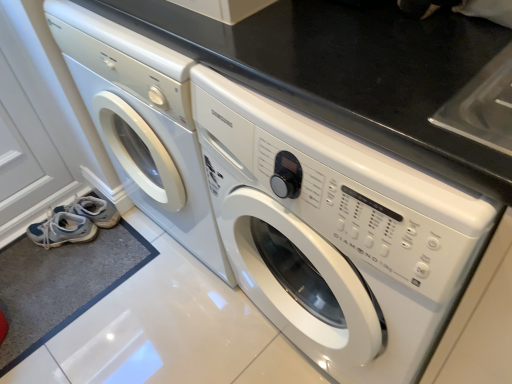
Question: From a real-world perspective, is light blue fabric shoe at lower left, which is the first shoe from bottom to top, located higher than white fabric shoe at lower left, which is the 2th shoe in bottom-to-top order?

Choices:
 (A) no
 (B) yes

Answer: (B)

Question: Considering the relative sizes of light blue fabric shoe at lower left, which is the first shoe from bottom to top, and white fabric shoe at lower left, the 1th shoe from the top, in the image provided, is light blue fabric shoe at lower left, which is the first shoe from bottom to top, shorter than white fabric shoe at lower left, the 1th shoe from the top,?

Choices:
 (A) no
 (B) yes

Answer: (B)

Question: Does light blue fabric shoe at lower left, the 2th shoe viewed from the top, contain white fabric shoe at lower left, the 1th shoe from the top?

Choices:
 (A) yes
 (B) no

Answer: (B)

Question: Is light blue fabric shoe at lower left, which is the first shoe from bottom to top, outside of white fabric shoe at lower left, which is the 2th shoe in bottom-to-top order?

Choices:
 (A) no
 (B) yes

Answer: (B)

Question: Does light blue fabric shoe at lower left, which is the first shoe from bottom to top, appear on the left side of white fabric shoe at lower left, which is the 2th shoe in bottom-to-top order?

Choices:
 (A) yes
 (B) no

Answer: (A)

Question: Considering the positions of white glossy washing machine at center, the second washing machine viewed from the right, and white glossy washing machine at center, the 1th washing machine positioned from the right, in the image, is white glossy washing machine at center, the second washing machine viewed from the right, wider or thinner than white glossy washing machine at center, the 1th washing machine positioned from the right,?

Choices:
 (A) wide
 (B) thin

Answer: (B)

Question: From a real-world perspective, is white glossy washing machine at center, the second washing machine viewed from the right, positioned above or below white glossy washing machine at center, acting as the 2th washing machine starting from the left?

Choices:
 (A) below
 (B) above

Answer: (B)

Question: Is white glossy washing machine at center, which ranks as the first washing machine in left-to-right order, in front of or behind white glossy washing machine at center, acting as the 2th washing machine starting from the left, in the image?

Choices:
 (A) behind
 (B) front

Answer: (A)

Question: Based on their sizes in the image, would you say white glossy washing machine at center, the second washing machine viewed from the right, is bigger or smaller than white glossy washing machine at center, acting as the 2th washing machine starting from the left?

Choices:
 (A) big
 (B) small

Answer: (A)

Question: Is white glossy washing machine at center, the 1th washing machine positioned from the right, taller or shorter than white fabric shoe at lower left, which is the 2th shoe in bottom-to-top order?

Choices:
 (A) tall
 (B) short

Answer: (A)

Question: Looking at their shapes, would you say white glossy washing machine at center, the 1th washing machine positioned from the right, is wider or thinner than white fabric shoe at lower left, the 1th shoe from the top?

Choices:
 (A) thin
 (B) wide

Answer: (B)

Question: From a real-world perspective, relative to white fabric shoe at lower left, which is the 2th shoe in bottom-to-top order, is white glossy washing machine at center, acting as the 2th washing machine starting from the left, vertically above or below?

Choices:
 (A) below
 (B) above

Answer: (B)

Question: Is white glossy washing machine at center, acting as the 2th washing machine starting from the left, to the left or to the right of white fabric shoe at lower left, the 1th shoe from the top, in the image?

Choices:
 (A) right
 (B) left

Answer: (A)

Question: Considering their positions, is white glossy washing machine at center, the second washing machine viewed from the right, located in front of or behind light blue fabric shoe at lower left, which is the first shoe from bottom to top?

Choices:
 (A) front
 (B) behind

Answer: (A)

Question: Is white glossy washing machine at center, which ranks as the first washing machine in left-to-right order, taller or shorter than light blue fabric shoe at lower left, which is the first shoe from bottom to top?

Choices:
 (A) tall
 (B) short

Answer: (A)